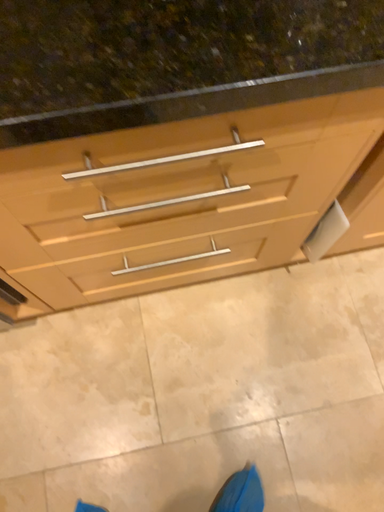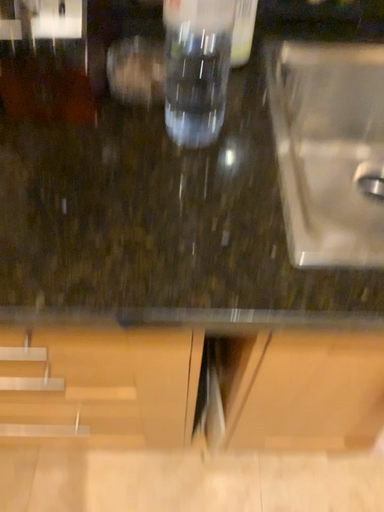
Question: How did the camera likely rotate when shooting the video?

Choices:
 (A) rotated upward
 (B) rotated downward

Answer: (A)